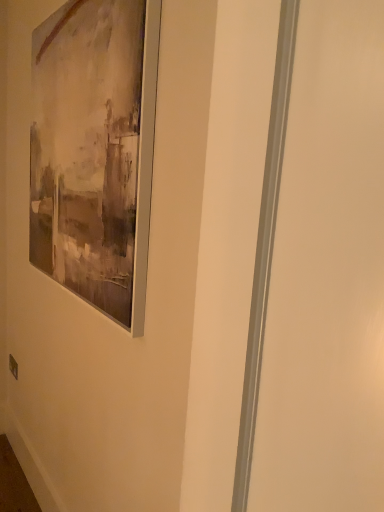
Question: Is matte brown frame at upper left wider or thinner than matte plastic outlet at lower left?

Choices:
 (A) wide
 (B) thin

Answer: (A)

Question: From a real-world perspective, is matte brown frame at upper left physically located above or below matte plastic outlet at lower left?

Choices:
 (A) above
 (B) below

Answer: (A)

Question: Considering their positions, is matte brown frame at upper left located in front of or behind matte plastic outlet at lower left?

Choices:
 (A) behind
 (B) front

Answer: (B)

Question: Considering the positions of point (11, 373) and point (104, 124), is point (11, 373) closer or farther from the camera than point (104, 124)?

Choices:
 (A) farther
 (B) closer

Answer: (A)

Question: Is matte plastic outlet at lower left bigger or smaller than matte brown frame at upper left?

Choices:
 (A) big
 (B) small

Answer: (B)

Question: Is matte plastic outlet at lower left taller or shorter than matte brown frame at upper left?

Choices:
 (A) short
 (B) tall

Answer: (A)

Question: Considering the relative positions of matte plastic outlet at lower left and matte brown frame at upper left in the image provided, is matte plastic outlet at lower left to the left or to the right of matte brown frame at upper left?

Choices:
 (A) right
 (B) left

Answer: (B)